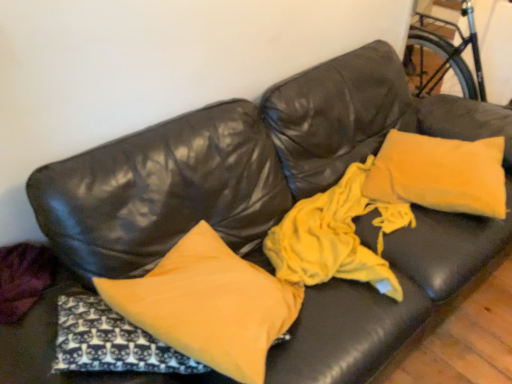
Identify the location of yellow soft pillow at upper right, marked as the second pillow in a left-to-right arrangement. 440,174.

Image resolution: width=512 pixels, height=384 pixels. What do you see at coordinates (440, 174) in the screenshot? I see `yellow soft pillow at upper right, which appears as the second pillow when viewed from the front` at bounding box center [440, 174].

How much space does yellow soft pillow at upper right, which appears as the first pillow when viewed from the back, occupy vertically?

yellow soft pillow at upper right, which appears as the first pillow when viewed from the back, is 4.22 inches tall.

What is the approximate width of yellow soft pillow at upper right, which appears as the second pillow when viewed from the front?

yellow soft pillow at upper right, which appears as the second pillow when viewed from the front, is 19.91 inches in width.

Find the location of a particular element. This screenshot has height=384, width=512. matte yellow pillow at center, arranged as the first pillow when viewed from the front is located at coordinates (209, 305).

What do you see at coordinates (209, 305) in the screenshot? The height and width of the screenshot is (384, 512). I see `matte yellow pillow at center, which is the 1th pillow from left to right` at bounding box center [209, 305].

Where is `yellow soft pillow at upper right, which appears as the first pillow when viewed from the back`? yellow soft pillow at upper right, which appears as the first pillow when viewed from the back is located at coordinates (440, 174).

Is yellow soft pillow at upper right, which appears as the second pillow when viewed from the front, at the right side of matte yellow pillow at center, arranged as the first pillow when viewed from the front?

Indeed, yellow soft pillow at upper right, which appears as the second pillow when viewed from the front, is positioned on the right side of matte yellow pillow at center, arranged as the first pillow when viewed from the front.

Based on the photo, which object is closer to the camera taking this photo, yellow soft pillow at upper right, marked as the second pillow in a left-to-right arrangement, or matte yellow pillow at center, which ranks as the second pillow in back-to-front order?

Positioned in front is matte yellow pillow at center, which ranks as the second pillow in back-to-front order.

Is point (420, 186) closer or farther from the camera than point (262, 364)?

Clearly, point (420, 186) is more distant from the camera than point (262, 364).

From the image's perspective, who appears lower, yellow soft pillow at upper right, which is counted as the first pillow, starting from the right, or matte yellow pillow at center, the 2th pillow positioned from the right?

From the image's view, matte yellow pillow at center, the 2th pillow positioned from the right, is below.

From a real-world perspective, is yellow soft pillow at upper right, marked as the second pillow in a left-to-right arrangement, located higher than matte yellow pillow at center, the 2th pillow positioned from the right?

No, from a real-world perspective, yellow soft pillow at upper right, marked as the second pillow in a left-to-right arrangement, is not on top of matte yellow pillow at center, the 2th pillow positioned from the right.

Between yellow soft pillow at upper right, marked as the second pillow in a left-to-right arrangement, and matte yellow pillow at center, the 2th pillow positioned from the right, which one has smaller width?

Thinner between the two is yellow soft pillow at upper right, marked as the second pillow in a left-to-right arrangement.

Who is taller, yellow soft pillow at upper right, which is counted as the first pillow, starting from the right, or matte yellow pillow at center, the 2th pillow positioned from the right?

With more height is matte yellow pillow at center, the 2th pillow positioned from the right.

Considering the relative sizes of yellow soft pillow at upper right, which appears as the first pillow when viewed from the back, and matte yellow pillow at center, the 2th pillow positioned from the right, in the image provided, is yellow soft pillow at upper right, which appears as the first pillow when viewed from the back, smaller than matte yellow pillow at center, the 2th pillow positioned from the right,?

Indeed, yellow soft pillow at upper right, which appears as the first pillow when viewed from the back, has a smaller size compared to matte yellow pillow at center, the 2th pillow positioned from the right.

Do you think yellow soft pillow at upper right, which appears as the second pillow when viewed from the front, is within matte yellow pillow at center, which is the 1th pillow from left to right, or outside of it?

yellow soft pillow at upper right, which appears as the second pillow when viewed from the front, is spatially situated outside matte yellow pillow at center, which is the 1th pillow from left to right.

Is yellow soft pillow at upper right, marked as the second pillow in a left-to-right arrangement, next to matte yellow pillow at center, which ranks as the second pillow in back-to-front order, and touching it?

There is a gap between yellow soft pillow at upper right, marked as the second pillow in a left-to-right arrangement, and matte yellow pillow at center, which ranks as the second pillow in back-to-front order.

Is yellow soft pillow at upper right, which is counted as the first pillow, starting from the right, facing towards matte yellow pillow at center, which ranks as the second pillow in back-to-front order?

No.

Find the location of a particular element. pillow above the yellow soft pillow at upper right, which appears as the first pillow when viewed from the back (from a real-world perspective) is located at coordinates (209, 305).

Based on their positions, is matte yellow pillow at center, the 2th pillow positioned from the right, located to the left or right of yellow soft pillow at upper right, which appears as the second pillow when viewed from the front?

From the image, it's evident that matte yellow pillow at center, the 2th pillow positioned from the right, is to the left of yellow soft pillow at upper right, which appears as the second pillow when viewed from the front.

Which is behind, matte yellow pillow at center, which is the 1th pillow from left to right, or yellow soft pillow at upper right, marked as the second pillow in a left-to-right arrangement?

yellow soft pillow at upper right, marked as the second pillow in a left-to-right arrangement, is more distant.

Which point is more forward, (226, 368) or (451, 174)?

The point (226, 368) is closer.

From the image's perspective, between matte yellow pillow at center, which is the 1th pillow from left to right, and yellow soft pillow at upper right, which appears as the second pillow when viewed from the front, which one is located above?

yellow soft pillow at upper right, which appears as the second pillow when viewed from the front.

From a real-world perspective, relative to yellow soft pillow at upper right, which is counted as the first pillow, starting from the right, is matte yellow pillow at center, which is the 1th pillow from left to right, vertically above or below?

In terms of real-world spatial position, matte yellow pillow at center, which is the 1th pillow from left to right, is above yellow soft pillow at upper right, which is counted as the first pillow, starting from the right.

Does matte yellow pillow at center, which ranks as the second pillow in back-to-front order, have a greater width compared to yellow soft pillow at upper right, marked as the second pillow in a left-to-right arrangement?

Indeed, matte yellow pillow at center, which ranks as the second pillow in back-to-front order, has a greater width compared to yellow soft pillow at upper right, marked as the second pillow in a left-to-right arrangement.

Is matte yellow pillow at center, the 2th pillow positioned from the right, shorter than yellow soft pillow at upper right, which is counted as the first pillow, starting from the right?

No.

Who is smaller, matte yellow pillow at center, which is the 1th pillow from left to right, or yellow soft pillow at upper right, which appears as the first pillow when viewed from the back?

yellow soft pillow at upper right, which appears as the first pillow when viewed from the back.

Would you say matte yellow pillow at center, the 2th pillow positioned from the right, is outside yellow soft pillow at upper right, which appears as the first pillow when viewed from the back?

Yes, matte yellow pillow at center, the 2th pillow positioned from the right, is outside of yellow soft pillow at upper right, which appears as the first pillow when viewed from the back.

Is matte yellow pillow at center, arranged as the first pillow when viewed from the front, beside yellow soft pillow at upper right, marked as the second pillow in a left-to-right arrangement?

No.

Is yellow soft pillow at upper right, which appears as the first pillow when viewed from the back, at the back of matte yellow pillow at center, arranged as the first pillow when viewed from the front?

No, yellow soft pillow at upper right, which appears as the first pillow when viewed from the back, is not at the back of matte yellow pillow at center, arranged as the first pillow when viewed from the front.

How distant is matte yellow pillow at center, which is the 1th pillow from left to right, from yellow soft pillow at upper right, marked as the second pillow in a left-to-right arrangement?

matte yellow pillow at center, which is the 1th pillow from left to right, and yellow soft pillow at upper right, marked as the second pillow in a left-to-right arrangement, are 30.25 inches apart from each other.

You are a GUI agent. You are given a task and a screenshot of the screen. Output one action in this format:
    pyautogui.click(x=<x>, y=<y>)
    Task: Click on the pillow below the yellow soft pillow at upper right, which appears as the first pillow when viewed from the back (from the image's perspective)
    Image resolution: width=512 pixels, height=384 pixels.
    Given the screenshot: What is the action you would take?
    pyautogui.click(x=209, y=305)

At what (x,y) coordinates should I click in order to perform the action: click on pillow located behind the matte yellow pillow at center, which is the 1th pillow from left to right. Please return your answer as a coordinate pair (x, y). Image resolution: width=512 pixels, height=384 pixels. Looking at the image, I should click on (440, 174).

Image resolution: width=512 pixels, height=384 pixels. In order to click on pillow above the yellow soft pillow at upper right, which appears as the second pillow when viewed from the front (from a real-world perspective) in this screenshot , I will do `click(209, 305)`.